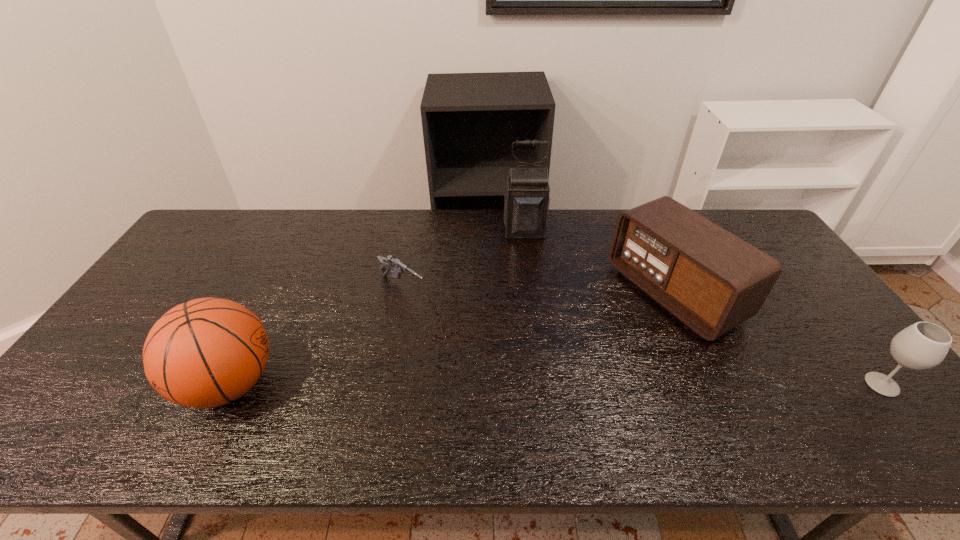
You are a GUI agent. You are given a task and a screenshot of the screen. Output one action in this format:
    pyautogui.click(x=<x>, y=<y>)
    Task: Click on the vacant space located 0.320m on the front-facing side of the lantern
    
    Given the screenshot: What is the action you would take?
    pyautogui.click(x=535, y=308)

The image size is (960, 540). Find the location of `vacant space situated on the front-facing side of the lantern`. vacant space situated on the front-facing side of the lantern is located at coordinates (533, 294).

I want to click on vacant space positioned 0.390m on the front-facing side of the radio receiver, so click(x=517, y=379).

The width and height of the screenshot is (960, 540). I want to click on vacant space located on the front-facing side of the radio receiver, so pyautogui.click(x=534, y=370).

This screenshot has width=960, height=540. In order to click on vacant space located 0.230m on the front-facing side of the radio receiver in this screenshot , I will do `click(568, 353)`.

I want to click on vacant space located 0.080m at the barrel of the shortest object, so click(439, 310).

In order to click on free spot located at the barrel of the shortest object in this screenshot , I will do `click(459, 325)`.

You are a GUI agent. You are given a task and a screenshot of the screen. Output one action in this format:
    pyautogui.click(x=<x>, y=<y>)
    Task: Click on the vacant space located 0.360m at the barrel of the shortest object
    
    Given the screenshot: What is the action you would take?
    (x=516, y=363)

Where is `lantern that is at the far edge`? The width and height of the screenshot is (960, 540). lantern that is at the far edge is located at coordinates (526, 199).

Locate an element on the screen. This screenshot has width=960, height=540. radio receiver that is at the far edge is located at coordinates (710, 279).